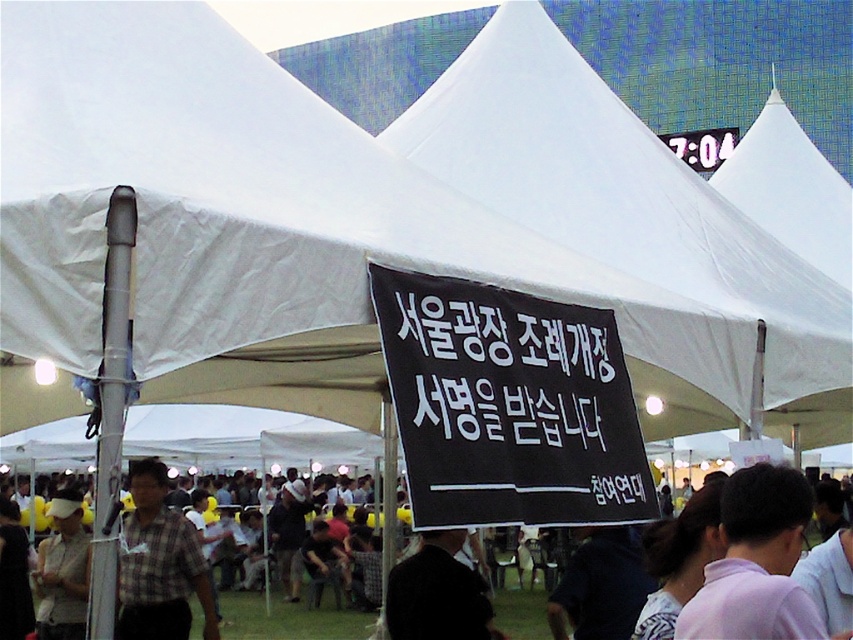
From the picture: You are organizing a photo shoot and need to ensure that the pink fabric shirt at lower right and the black fabric at center are visible in the frame. Given their sizes, which object should you prioritize positioning closer to the camera to ensure clarity?

The pink fabric shirt at lower right has a lesser width compared to the black fabric at center, so you should prioritize positioning the pink fabric shirt at lower right closer to the camera to ensure clarity.

You are a photographer at the event and want to capture both the black fabric at center and the light beige fabric cap at lower left in a single frame. Which object should you position closer to the camera to ensure both are in focus?

The black fabric at center is shorter than the light beige fabric cap at lower left. To ensure both are in focus, position the black fabric at center closer to the camera since it is shorter and requires less depth of field adjustment compared to the taller light beige fabric cap at lower left.